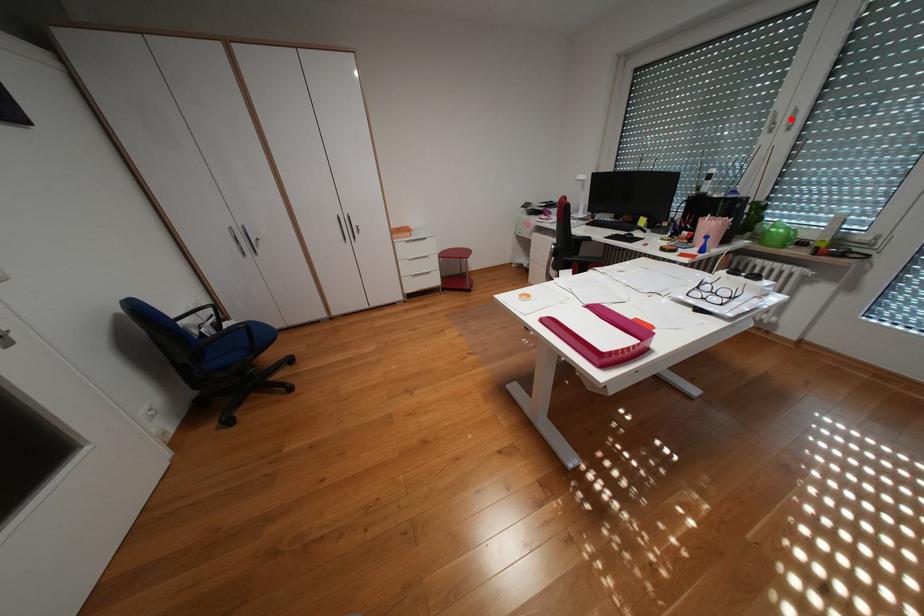
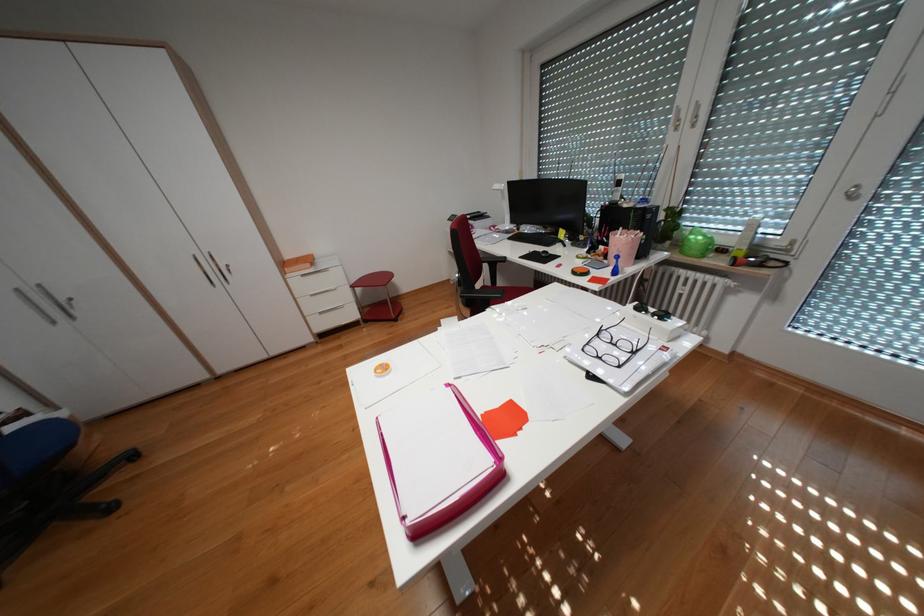
The point at the highlighted location is marked in the first image. Where is the corresponding point in the second image?

(695, 116)